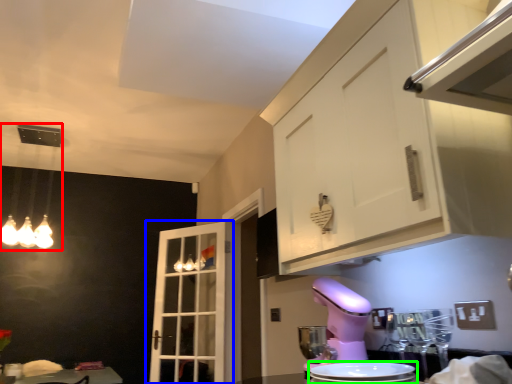
Question: Based on their relative distances, which object is farther from light fixture (highlighted by a red box)? Choose from door (highlighted by a blue box) and appliance (highlighted by a green box).

Choices:
 (A) door
 (B) appliance

Answer: (B)